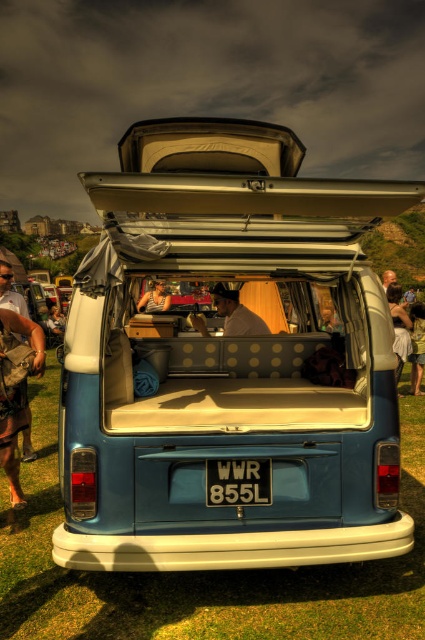
Between light brown leather jacket at center and white cotton dress at right, which one is positioned higher?

light brown leather jacket at center

Is light brown leather jacket at center above white cotton dress at right?

Indeed, light brown leather jacket at center is positioned over white cotton dress at right.

Is point (263, 323) farther from viewer compared to point (399, 310)?

No, it is in front of (399, 310).

Where is `light brown leather jacket at center`? light brown leather jacket at center is located at coordinates (237, 314).

Is black metal license plate at center above matte black shirt at center?

Actually, black metal license plate at center is below matte black shirt at center.

Which of these two, black metal license plate at center or matte black shirt at center, stands taller?

Standing taller between the two is matte black shirt at center.

What do you see at coordinates (238, 481) in the screenshot?
I see `black metal license plate at center` at bounding box center [238, 481].

I want to click on black metal license plate at center, so click(x=238, y=481).

Is brown leather bag at lower left positioned behind matte black shirt at center?

No, brown leather bag at lower left is in front of matte black shirt at center.

Is brown leather bag at lower left smaller than matte black shirt at center?

Incorrect, brown leather bag at lower left is not smaller in size than matte black shirt at center.

What are the coordinates of `brown leather bag at lower left` in the screenshot? It's located at (16, 376).

Find the location of a particular element. This screenshot has width=425, height=640. brown leather bag at lower left is located at coordinates (16, 376).